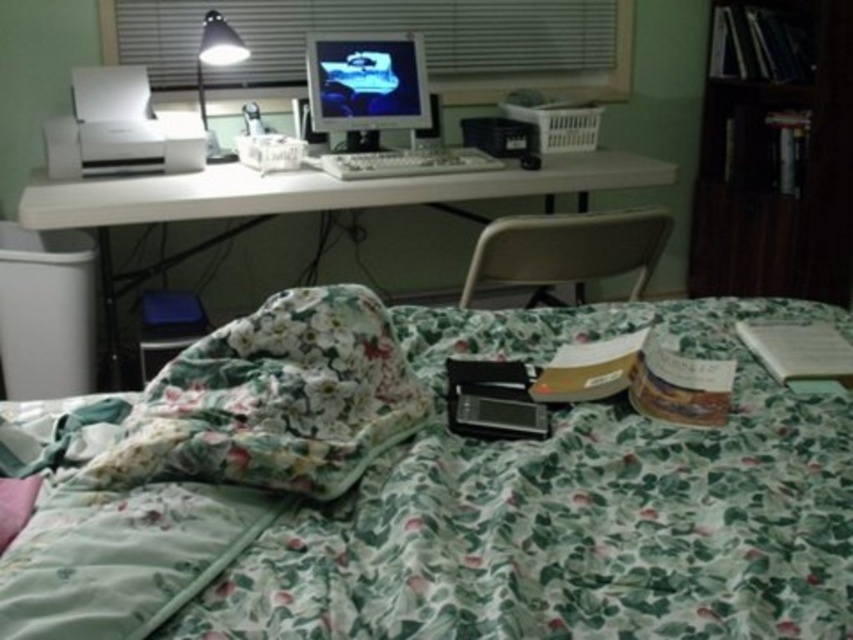
Is dark wood bookshelf at upper right wider than matte plastic computer monitor at center?

Correct, the width of dark wood bookshelf at upper right exceeds that of matte plastic computer monitor at center.

Who is lower down, dark wood bookshelf at upper right or matte plastic computer monitor at center?

dark wood bookshelf at upper right is below.

Describe the element at coordinates (775, 152) in the screenshot. I see `dark wood bookshelf at upper right` at that location.

The width and height of the screenshot is (853, 640). I want to click on dark wood bookshelf at upper right, so click(x=775, y=152).

Measure the distance between floral fabric bed at center and dark wood bookshelf at upper right.

6.04 feet

Who is higher up, floral fabric bed at center or dark wood bookshelf at upper right?

dark wood bookshelf at upper right is higher up.

This screenshot has width=853, height=640. What do you see at coordinates (567, 506) in the screenshot? I see `floral fabric bed at center` at bounding box center [567, 506].

Locate an element on the screen. This screenshot has width=853, height=640. floral fabric bed at center is located at coordinates [x=567, y=506].

Is dark wood bookshelf at upper right below white plastic blinds at upper center?

Yes.

Is dark wood bookshelf at upper right taller than white plastic blinds at upper center?

Yes, dark wood bookshelf at upper right is taller than white plastic blinds at upper center.

Which is in front, point (766, 32) or point (166, 52)?

Positioned in front is point (166, 52).

The width and height of the screenshot is (853, 640). Identify the location of dark wood bookshelf at upper right. (775, 152).